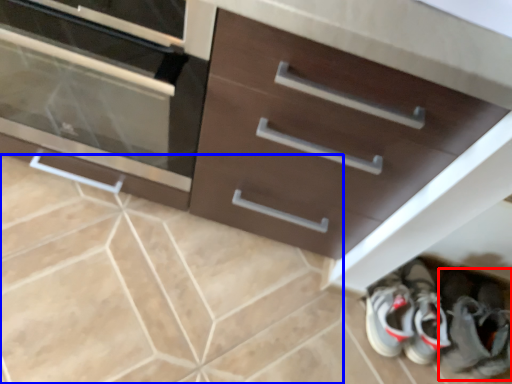
Question: Which object appears closest to the camera in this image, footwear (highlighted by a red box) or ceramic tile (highlighted by a blue box)?

Choices:
 (A) footwear
 (B) ceramic tile

Answer: (B)